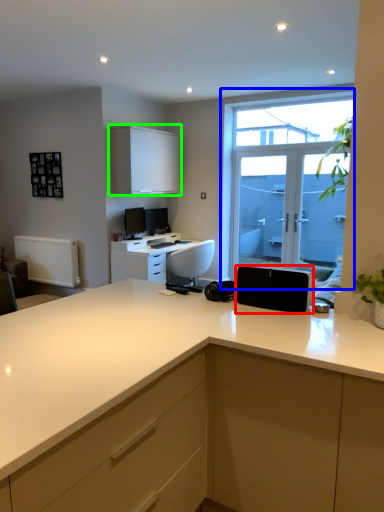
Question: Which object is positioned closest to appliance (highlighted by a red box)? Select from window (highlighted by a blue box) and cabinetry (highlighted by a green box).

Choices:
 (A) window
 (B) cabinetry

Answer: (A)